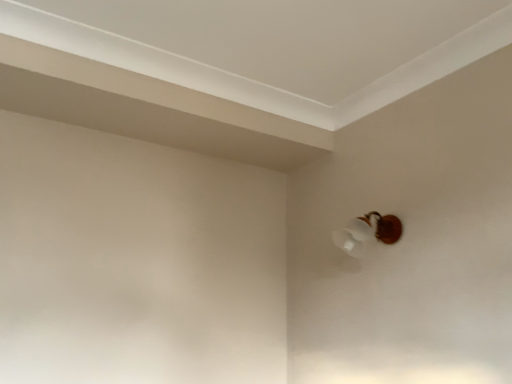
The width and height of the screenshot is (512, 384). Describe the element at coordinates (367, 232) in the screenshot. I see `translucent glass lampshade at upper right` at that location.

What is the approximate height of translucent glass lampshade at upper right?

translucent glass lampshade at upper right is 7.50 inches in height.

In order to face translucent glass lampshade at upper right, should I rotate leftwards or rightwards?

Turn right by 14.753 degrees to look at translucent glass lampshade at upper right.

Image resolution: width=512 pixels, height=384 pixels. Find the location of `translucent glass lampshade at upper right`. translucent glass lampshade at upper right is located at coordinates (367, 232).

You are a GUI agent. You are given a task and a screenshot of the screen. Output one action in this format:
    pyautogui.click(x=<x>, y=<y>)
    Task: Click on the translucent glass lampshade at upper right
    This screenshot has width=512, height=384.
    Given the screenshot: What is the action you would take?
    pyautogui.click(x=367, y=232)